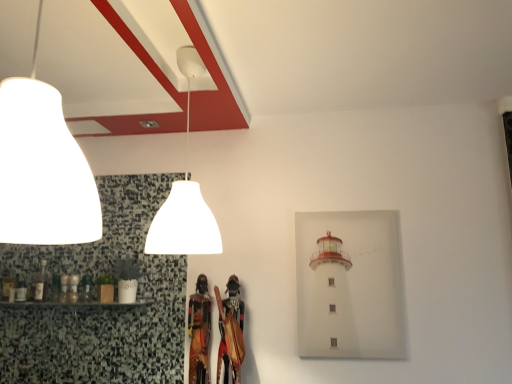
Question: Is white matte lampshade at upper center, the 2th lamp in the front-to-back sequence, taller than matte white lampshade at upper left, marked as the second lamp in a back-to-front arrangement?

Choices:
 (A) no
 (B) yes

Answer: (B)

Question: From a real-world perspective, is white matte lampshade at upper center, the 2th lamp in the front-to-back sequence, on top of matte white lampshade at upper left, marked as the second lamp in a back-to-front arrangement?

Choices:
 (A) no
 (B) yes

Answer: (B)

Question: Considering the relative sizes of white matte lampshade at upper center, positioned as the first lamp in back-to-front order, and matte white lampshade at upper left, the 1th lamp when ordered from front to back, in the image provided, is white matte lampshade at upper center, positioned as the first lamp in back-to-front order, thinner than matte white lampshade at upper left, the 1th lamp when ordered from front to back,?

Choices:
 (A) yes
 (B) no

Answer: (B)

Question: Does white matte lampshade at upper center, positioned as the first lamp in back-to-front order, come in front of matte white lampshade at upper left, the 1th lamp when ordered from front to back?

Choices:
 (A) no
 (B) yes

Answer: (A)

Question: Considering the relative sizes of white matte lampshade at upper center, the 2th lamp in the front-to-back sequence, and matte white lampshade at upper left, marked as the second lamp in a back-to-front arrangement, in the image provided, is white matte lampshade at upper center, the 2th lamp in the front-to-back sequence, shorter than matte white lampshade at upper left, marked as the second lamp in a back-to-front arrangement,?

Choices:
 (A) no
 (B) yes

Answer: (A)

Question: Can you confirm if white matte lampshade at upper center, the 2th lamp in the front-to-back sequence, is wider than matte white lampshade at upper left, the 1th lamp when ordered from front to back?

Choices:
 (A) yes
 (B) no

Answer: (A)

Question: Considering the relative sizes of matte white lampshade at upper left, the 1th lamp when ordered from front to back, and white matte lampshade at upper center, the 2th lamp in the front-to-back sequence, in the image provided, is matte white lampshade at upper left, the 1th lamp when ordered from front to back, smaller than white matte lampshade at upper center, the 2th lamp in the front-to-back sequence,?

Choices:
 (A) no
 (B) yes

Answer: (B)

Question: Is matte white lampshade at upper left, the 1th lamp when ordered from front to back, positioned far away from white matte lampshade at upper center, positioned as the first lamp in back-to-front order?

Choices:
 (A) no
 (B) yes

Answer: (A)

Question: Can you confirm if matte white lampshade at upper left, the 1th lamp when ordered from front to back, is wider than white matte lampshade at upper center, the 2th lamp in the front-to-back sequence?

Choices:
 (A) no
 (B) yes

Answer: (A)

Question: Would you say matte white lampshade at upper left, the 1th lamp when ordered from front to back, contains white matte lampshade at upper center, the 2th lamp in the front-to-back sequence?

Choices:
 (A) no
 (B) yes

Answer: (A)

Question: From a real-world perspective, does matte white lampshade at upper left, marked as the second lamp in a back-to-front arrangement, sit lower than white matte lampshade at upper center, the 2th lamp in the front-to-back sequence?

Choices:
 (A) no
 (B) yes

Answer: (B)

Question: Is matte white lampshade at upper left, the 1th lamp when ordered from front to back, looking in the opposite direction of white matte lampshade at upper center, the 2th lamp in the front-to-back sequence?

Choices:
 (A) no
 (B) yes

Answer: (A)

Question: From the image's perspective, relative to matte white lampshade at upper left, the 1th lamp when ordered from front to back, is white matte lampshade at upper center, positioned as the first lamp in back-to-front order, above or below?

Choices:
 (A) below
 (B) above

Answer: (A)